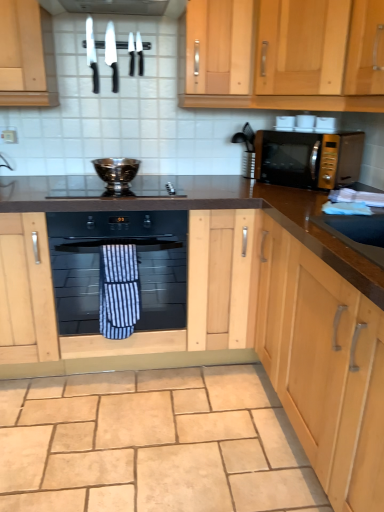
Locate an element on the screen. light wood cabinet at upper center, the second cabinetry from the bottom is located at coordinates (268, 95).

This screenshot has width=384, height=512. What do you see at coordinates (131, 54) in the screenshot?
I see `black plastic knife at upper center, which is the 2th knife in right-to-left order` at bounding box center [131, 54].

The image size is (384, 512). What are the coordinates of `black plastic knife at upper center, which is the 2th knife in right-to-left order` in the screenshot? It's located at (131, 54).

What do you see at coordinates (112, 55) in the screenshot?
I see `shiny silver knife at upper center, positioned as the second knife in left-to-right order` at bounding box center [112, 55].

Image resolution: width=384 pixels, height=512 pixels. What do you see at coordinates (115, 189) in the screenshot?
I see `black glass gas stove at center` at bounding box center [115, 189].

This screenshot has width=384, height=512. Identify the location of shiny silver knife at upper left, which appears as the first knife when viewed from the left. (92, 55).

Find the location of a particular element. blue striped towel at center is located at coordinates (119, 291).

Locate an element on the screen. This screenshot has width=384, height=512. silver metallic bowl at center is located at coordinates (116, 172).

Considering the relative sizes of silver metallic bowl at center and black glass oven at center in the image provided, is silver metallic bowl at center shorter than black glass oven at center?

Yes.

Are silver metallic bowl at center and black glass oven at center far apart?

silver metallic bowl at center is near black glass oven at center, not far away.

From the image's perspective, between silver metallic bowl at center and black glass oven at center, which one is located above?

silver metallic bowl at center appears higher in the image.

Considering the sizes of objects shiny silver knife at upper left, which appears as the first knife when viewed from the left, and light wood cabinet at upper center, arranged as the second cabinetry when viewed from the left, in the image provided, who is taller, shiny silver knife at upper left, which appears as the first knife when viewed from the left, or light wood cabinet at upper center, arranged as the second cabinetry when viewed from the left,?

light wood cabinet at upper center, arranged as the second cabinetry when viewed from the left, is taller.

Which is nearer, (x=91, y=49) or (x=305, y=95)?

The point (x=305, y=95) is closer.

Which cabinetry is the 2nd one when counting from the front of the shiny silver knife at upper left, which appears as the first knife when viewed from the left? Please provide its 2D coordinates.

[(268, 95)]

Could light wood cabinet at upper center, which appears as the first cabinetry when viewed from the top, be considered to be inside black plastic knife at upper center, acting as the 4th knife starting from the left?

No, light wood cabinet at upper center, which appears as the first cabinetry when viewed from the top, is not surrounded by black plastic knife at upper center, acting as the 4th knife starting from the left.

Which is more to the left, black plastic knife at upper center, acting as the 4th knife starting from the left, or light wood cabinet at upper center, the second cabinetry from the bottom?

black plastic knife at upper center, acting as the 4th knife starting from the left, is more to the left.

Locate an element on the screen. The width and height of the screenshot is (384, 512). the 4th knife behind the light wood cabinet at upper center, placed as the 1th cabinetry when sorted from right to left, counting from the anchor's position is located at coordinates (140, 54).

Looking at their sizes, would you say black plastic knife at upper center, the third knife from the left, is wider or thinner than black glass gas stove at center?

Considering their sizes, black plastic knife at upper center, the third knife from the left, looks slimmer than black glass gas stove at center.

Is black plastic knife at upper center, which is the 2th knife in right-to-left order, far from black glass gas stove at center?

No, black plastic knife at upper center, which is the 2th knife in right-to-left order, is in close proximity to black glass gas stove at center.

From the image's perspective, is black plastic knife at upper center, the third knife from the left, on black glass gas stove at center?

Yes, from the image's perspective, black plastic knife at upper center, the third knife from the left, is over black glass gas stove at center.

At what (x,y) coordinates should I click in order to perform the action: click on the 3rd knife behind the silver metallic bowl at center, starting your count from the anchor. Please return your answer as a coordinate pair (x, y). Looking at the image, I should click on (131, 54).

Between black plastic knife at upper center, the third knife from the left, and silver metallic bowl at center, which one has larger size?

With larger size is silver metallic bowl at center.

Which is in front, point (130, 74) or point (116, 158)?

The point (130, 74) is closer.

Is point (251, 275) closer to viewer compared to point (140, 54)?

Yes, point (251, 275) is in front of point (140, 54).

In terms of height, does black matte oven at center, which is the first cabinetry in left-to-right order, look taller or shorter compared to black plastic knife at upper center, arranged as the 1th knife when viewed from the right?

black matte oven at center, which is the first cabinetry in left-to-right order, is taller than black plastic knife at upper center, arranged as the 1th knife when viewed from the right.

At what (x,y) coordinates should I click in order to perform the action: click on cabinetry on the left of black plastic knife at upper center, acting as the 4th knife starting from the left. Please return your answer as a coordinate pair (x, y). This screenshot has height=512, width=384. Looking at the image, I should click on (136, 281).

Between black plastic knife at upper center, which is the 2th knife in right-to-left order, and beige stone floor at lower center, which one has smaller width?

black plastic knife at upper center, which is the 2th knife in right-to-left order, is thinner.

Which object is positioned more to the right, black plastic knife at upper center, the third knife from the left, or beige stone floor at lower center?

From the viewer's perspective, beige stone floor at lower center appears more on the right side.

Could you tell me if black plastic knife at upper center, the third knife from the left, is facing beige stone floor at lower center?

No, black plastic knife at upper center, the third knife from the left, is not oriented towards beige stone floor at lower center.

Is black plastic knife at upper center, which is the 2th knife in right-to-left order, with beige stone floor at lower center?

black plastic knife at upper center, which is the 2th knife in right-to-left order, and beige stone floor at lower center are not in contact.

The height and width of the screenshot is (512, 384). I want to click on home appliance that is below the silver metallic bowl at center (from the image's perspective), so click(x=118, y=271).

Starting from the light wood cabinet at upper center, placed as the 1th cabinetry when sorted from right to left, which knife is the 1st one behind? Please provide its 2D coordinates.

[(92, 55)]

From the picture: Looking at the image, which one is located further to gold metallic microwave at upper right, shiny silver knife at upper center, positioned as the 3th knife in right-to-left order, or blue striped towel at center?

Among the two, shiny silver knife at upper center, positioned as the 3th knife in right-to-left order, is located further to gold metallic microwave at upper right.

Estimate the real-world distances between objects in this image. Which object is further from black matte oven at center, positioned as the 1th cabinetry in bottom-to-top order, gold metallic microwave at upper right or blue striped towel at center?

The object further to black matte oven at center, positioned as the 1th cabinetry in bottom-to-top order, is gold metallic microwave at upper right.

When comparing their distances from black glass oven at center, does black plastic knife at upper center, acting as the 4th knife starting from the left, or beige stone floor at lower center seem further?

The object further to black glass oven at center is black plastic knife at upper center, acting as the 4th knife starting from the left.

Considering their positions, is shiny silver knife at upper center, positioned as the 3th knife in right-to-left order, positioned further to black plastic knife at upper center, which is the 2th knife in right-to-left order, than silver metallic bowl at center?

silver metallic bowl at center lies further to black plastic knife at upper center, which is the 2th knife in right-to-left order, than the other object.

Looking at the image, which one is located further to beige stone floor at lower center, black glass gas stove at center or light wood cabinet at upper center, placed as the 1th cabinetry when sorted from right to left?

Based on the image, light wood cabinet at upper center, placed as the 1th cabinetry when sorted from right to left, appears to be further to beige stone floor at lower center.

Looking at the image, which one is located further to black plastic knife at upper center, arranged as the 1th knife when viewed from the right, silver metallic bowl at center or blue striped towel at center?

blue striped towel at center.

From the image, which object appears to be farther from black plastic knife at upper center, which is the 2th knife in right-to-left order, shiny silver knife at upper center, positioned as the second knife in left-to-right order, or shiny silver knife at upper left, which appears as the first knife when viewed from the left?

shiny silver knife at upper left, which appears as the first knife when viewed from the left, lies further to black plastic knife at upper center, which is the 2th knife in right-to-left order, than the other object.

Based on their spatial positions, is gold metallic microwave at upper right or shiny silver knife at upper left, which appears as the first knife when viewed from the left, further from beige stone floor at lower center?

Among the two, shiny silver knife at upper left, which appears as the first knife when viewed from the left, is located further to beige stone floor at lower center.

Locate an element on the screen. cabinetry between black plastic knife at upper center, which is the 2th knife in right-to-left order, and black glass oven at center in the up-down direction is located at coordinates (268, 95).

Where is `home appliance between shiny silver knife at upper center, positioned as the second knife in left-to-right order, and blue striped towel at center in the up-down direction`? The width and height of the screenshot is (384, 512). home appliance between shiny silver knife at upper center, positioned as the second knife in left-to-right order, and blue striped towel at center in the up-down direction is located at coordinates (118, 271).

Locate an element on the screen. This screenshot has height=512, width=384. gas stove between black matte oven at center, which is the first cabinetry in left-to-right order, and light wood cabinet at upper center, the second cabinetry from the bottom, in the horizontal direction is located at coordinates (115, 189).

Where is `appliance between black plastic knife at upper center, the third knife from the left, and black matte oven at center, positioned as the second cabinetry in top-to-bottom order, vertically`? Image resolution: width=384 pixels, height=512 pixels. appliance between black plastic knife at upper center, the third knife from the left, and black matte oven at center, positioned as the second cabinetry in top-to-bottom order, vertically is located at coordinates (116, 172).